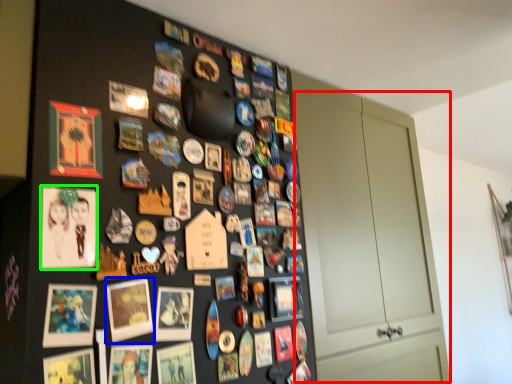
Question: Estimate the real-world distances between objects in this image. Which object is farther from door (highlighted by a red box), picture frame (highlighted by a blue box) or picture frame (highlighted by a green box)?

Choices:
 (A) picture frame
 (B) picture frame

Answer: (B)